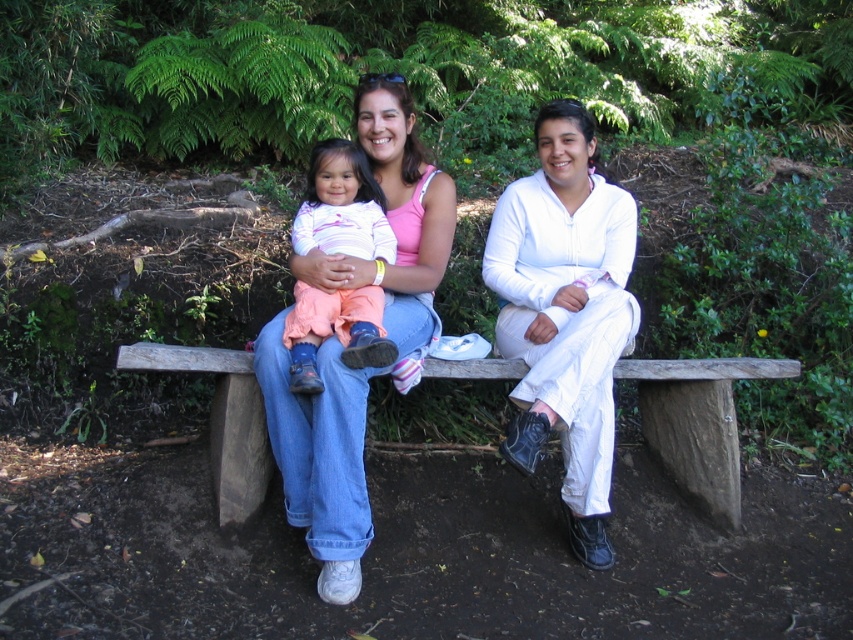
Question: Which is nearer to the white matte pants at center?

Choices:
 (A) matte pink tank top at center
 (B) wooden bench at center
 (C) matte pink shirt at center

Answer: (B)

Question: Can you confirm if matte pink tank top at center is positioned to the left of wooden bench at center?

Choices:
 (A) yes
 (B) no

Answer: (A)

Question: Among these points, which one is farthest from the camera?

Choices:
 (A) (572, 189)
 (B) (305, 332)

Answer: (A)

Question: Does white matte pants at center have a smaller size compared to matte pink shirt at center?

Choices:
 (A) no
 (B) yes

Answer: (A)

Question: Is matte pink tank top at center thinner than wooden bench at center?

Choices:
 (A) yes
 (B) no

Answer: (A)

Question: Which object is farther from the camera taking this photo?

Choices:
 (A) matte pink shirt at center
 (B) matte pink tank top at center

Answer: (B)